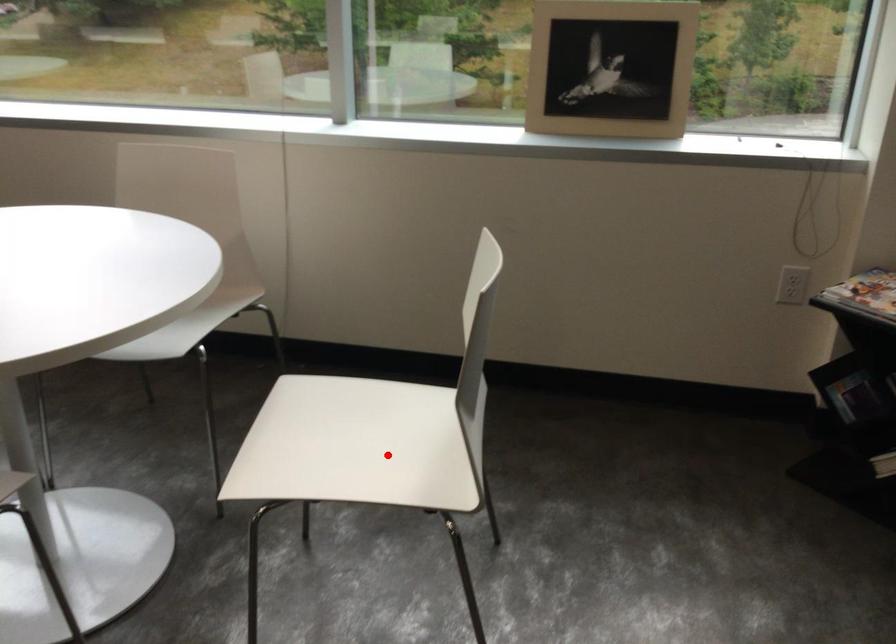
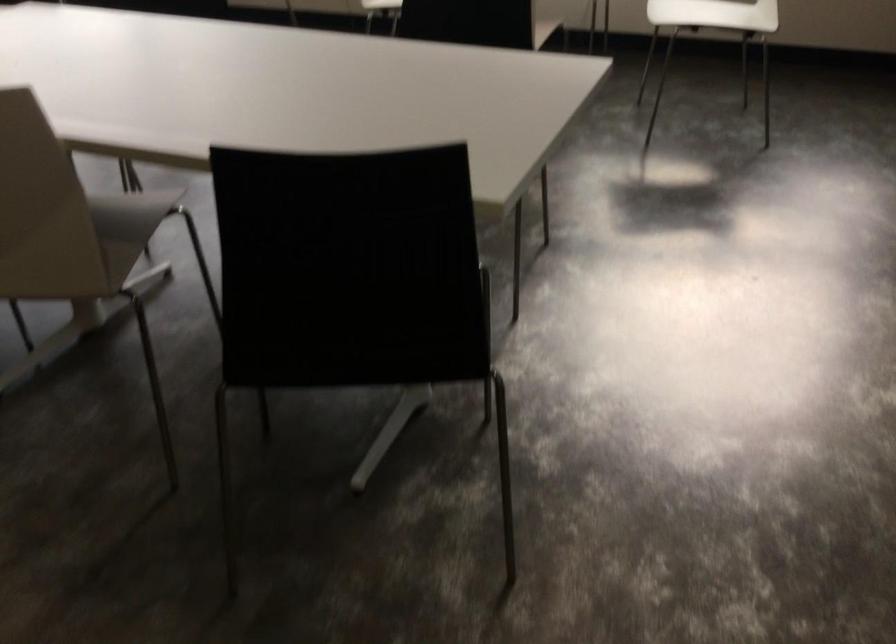
Question: I am providing you with two images of the same scene from different viewpoints. A red point is shown in image1. For the corresponding object point in image2, is it positioned nearer or farther from the camera?

Choices:
 (A) Nearer
 (B) Farther

Answer: (B)